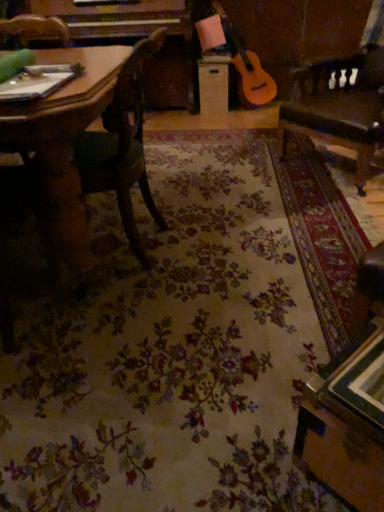
Question: Is wooden drawer at center next to wooden chair at left?

Choices:
 (A) yes
 (B) no

Answer: (B)

Question: From a real-world perspective, is wooden drawer at center positioned over wooden chair at left based on gravity?

Choices:
 (A) no
 (B) yes

Answer: (A)

Question: Is wooden drawer at center facing away from wooden chair at left?

Choices:
 (A) yes
 (B) no

Answer: (B)

Question: Is wooden drawer at center to the left of wooden chair at left from the viewer's perspective?

Choices:
 (A) no
 (B) yes

Answer: (A)

Question: Can you confirm if wooden drawer at center is shorter than wooden chair at left?

Choices:
 (A) no
 (B) yes

Answer: (B)

Question: From the image's perspective, is wooden drawer at center above or below leather swivel chair at right?

Choices:
 (A) below
 (B) above

Answer: (B)

Question: Looking at their shapes, would you say wooden drawer at center is wider or thinner than leather swivel chair at right?

Choices:
 (A) wide
 (B) thin

Answer: (B)

Question: Is point (210, 70) positioned closer to the camera than point (339, 80)?

Choices:
 (A) farther
 (B) closer

Answer: (A)

Question: Is wooden drawer at center to the left or to the right of leather swivel chair at right in the image?

Choices:
 (A) right
 (B) left

Answer: (B)

Question: Visually, is wooden chair at left positioned to the left or to the right of leather swivel chair at right?

Choices:
 (A) left
 (B) right

Answer: (A)

Question: In the image, is wooden chair at left positioned in front of or behind leather swivel chair at right?

Choices:
 (A) behind
 (B) front

Answer: (B)

Question: Based on their sizes in the image, would you say wooden chair at left is bigger or smaller than leather swivel chair at right?

Choices:
 (A) small
 (B) big

Answer: (A)

Question: From the image's perspective, is wooden chair at left above or below leather swivel chair at right?

Choices:
 (A) above
 (B) below

Answer: (B)

Question: Is point (223, 76) positioned closer to the camera than point (137, 253)?

Choices:
 (A) farther
 (B) closer

Answer: (A)

Question: Is wooden drawer at center taller or shorter than wooden chair at left?

Choices:
 (A) tall
 (B) short

Answer: (B)